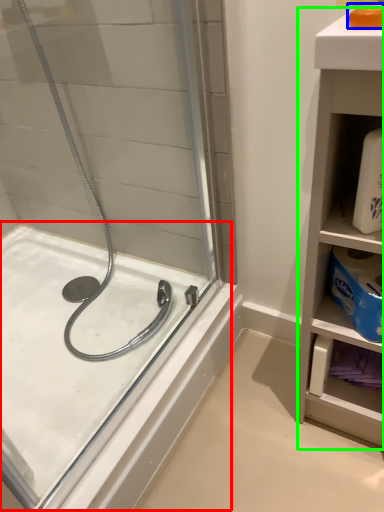
Question: Which is farther away from bath (highlighted by a red box)? soap (highlighted by a blue box) or bathroom cabinet (highlighted by a green box)?

Choices:
 (A) soap
 (B) bathroom cabinet

Answer: (A)